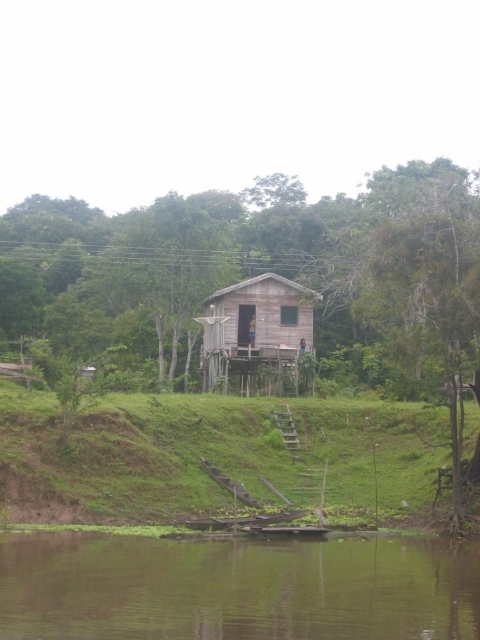
Is point (74, 227) closer to camera compared to point (280, 317)?

No, (74, 227) is behind (280, 317).

Is point (243, 342) positioned after point (288, 339)?

Yes, point (243, 342) is farther from viewer.

Who is more distant from viewer, (403, 275) or (230, 344)?

The point (230, 344) is more distant.

Where is `green leafy tree at center`? green leafy tree at center is located at coordinates (257, 285).

Can you confirm if green smooth water at lower center is positioned to the right of brown wooden hut at center?

Indeed, green smooth water at lower center is positioned on the right side of brown wooden hut at center.

Locate an element on the screen. green smooth water at lower center is located at coordinates (236, 588).

Find the location of a particular element. green smooth water at lower center is located at coordinates (x=236, y=588).

Is green smooth water at lower center taller than green grassy hillside at lower center?

No.

Can you confirm if green smooth water at lower center is positioned to the left of green grassy hillside at lower center?

Yes, green smooth water at lower center is to the left of green grassy hillside at lower center.

The height and width of the screenshot is (640, 480). I want to click on green smooth water at lower center, so click(236, 588).

The height and width of the screenshot is (640, 480). What are the coordinates of `green smooth water at lower center` in the screenshot? It's located at (236, 588).